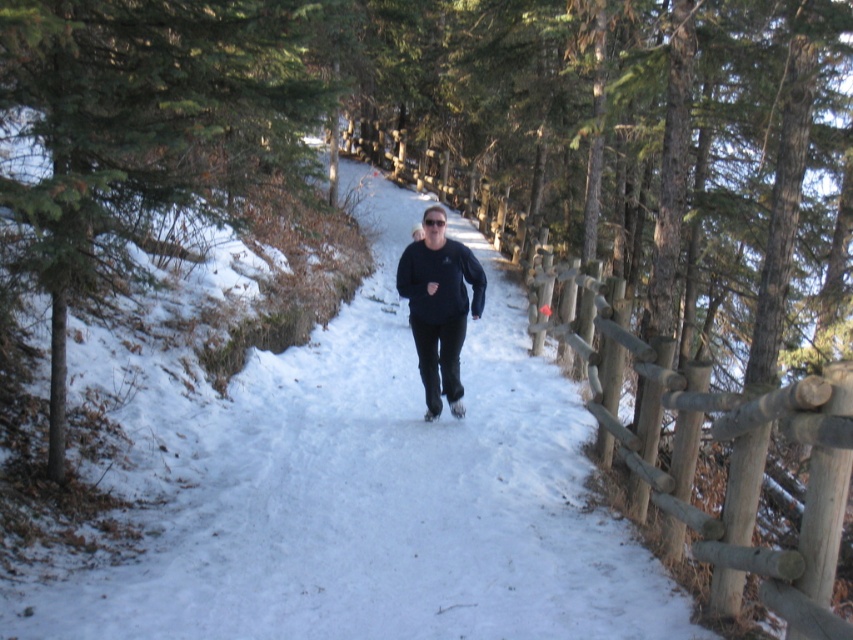
You are standing on the snowy trail and want to reach the wooden fence on the right. The green evergreen tree at left is in your way. Can you walk around it to get to the fence?

The green evergreen tree at left is 11.64 feet away from you, so you can walk around it to reach the wooden fence on the right.